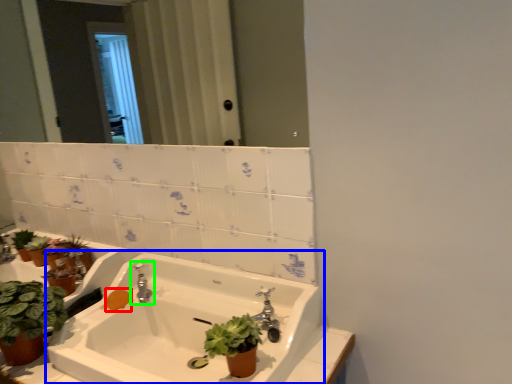
Question: Which object is the closest to the soap (highlighted by a red box)? Choose among these: sink (highlighted by a blue box) or tap (highlighted by a green box).

Choices:
 (A) sink
 (B) tap

Answer: (B)